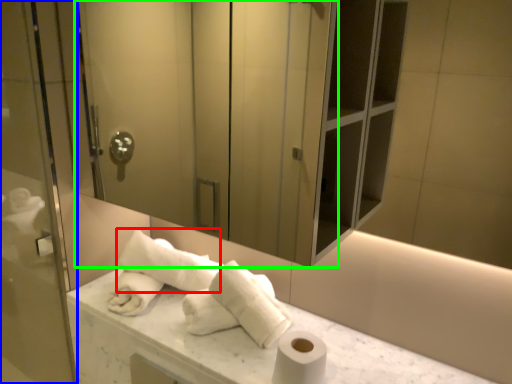
Question: Estimate the real-world distances between objects in this image. Which object is farther from bath towel (highlighted by a red box), screen door (highlighted by a blue box) or screen door (highlighted by a green box)?

Choices:
 (A) screen door
 (B) screen door

Answer: (B)